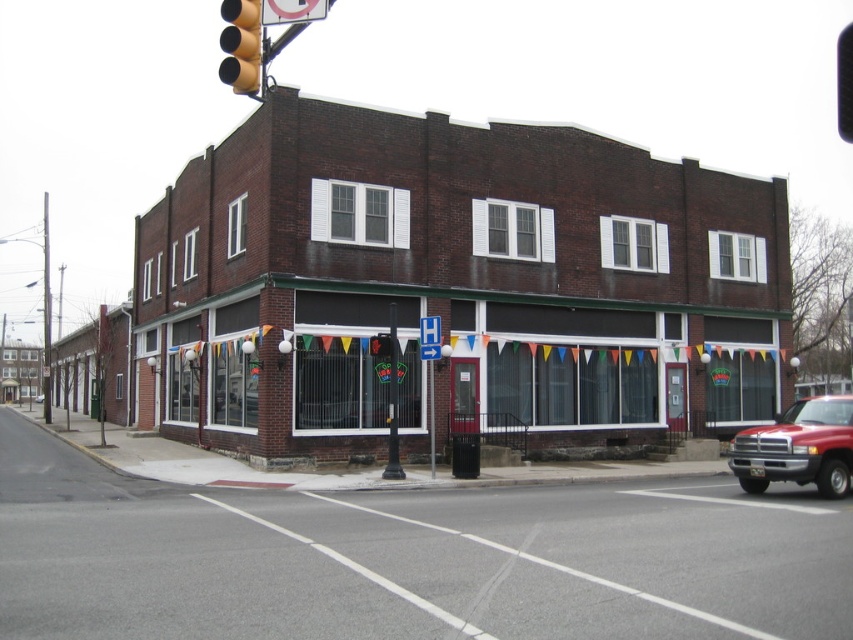
You are standing at the corner of the street where the two story brick building is located. You see a point marked at coordinate (459, 310). Based on the scene description, where is this point located?

The point is located on the brick storefront at center.

You are a pedestrian standing at the intersection and see the brown brick building at center and the black metal traffic light at upper left. Which object is positioned higher from the ground?

Answer: The black metal traffic light at upper left is positioned higher from the ground than the brown brick building at center.

You are a delivery person trying to park your van that is 3 meters wide. You see the brick storefront at center and the black metal traffic light at upper left. Which object has enough space to park next to without overlapping?

The black metal traffic light at upper left has a greater width than the brick storefront at center, so parking next to the black metal traffic light at upper left would provide sufficient space for the van since it is wider.